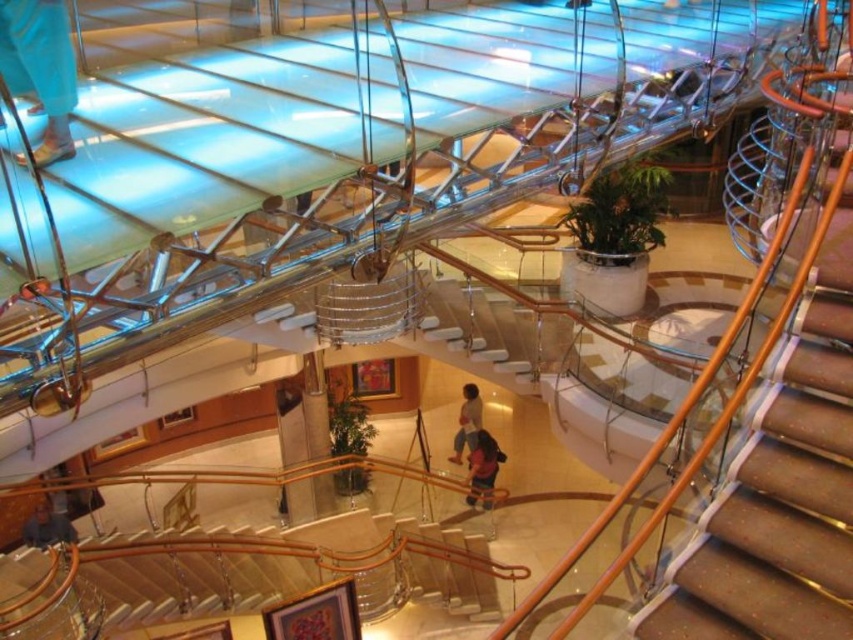
You are a delivery person carrying a package and need to place it on a table. You see a dark blue shirt at center and a light brown leather jacket at center. Which object is closer to the table?

The dark blue shirt at center is 51.91 centimeters away from light brown leather jacket at center. However, since both objects are at the center, their distance to the table cannot be determined without additional information about the table location.

You are a delivery person carrying a large package that is 1.5 meters wide. You need to navigate through the wooden stairs at center and around the blue denim jeans at lower left. Based on their widths, which path should you choose to ensure the package fits through?

The wooden stairs at center has a width less than the blue denim jeans at lower left. Since the package is 1.5 meters wide, you should choose the path around the blue denim jeans at lower left as it is wider than the wooden stairs at center.